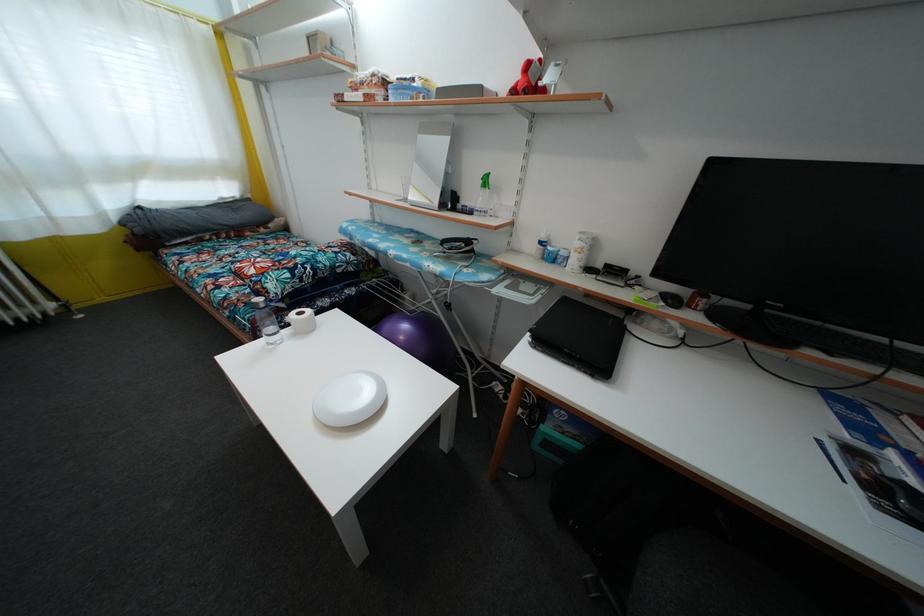
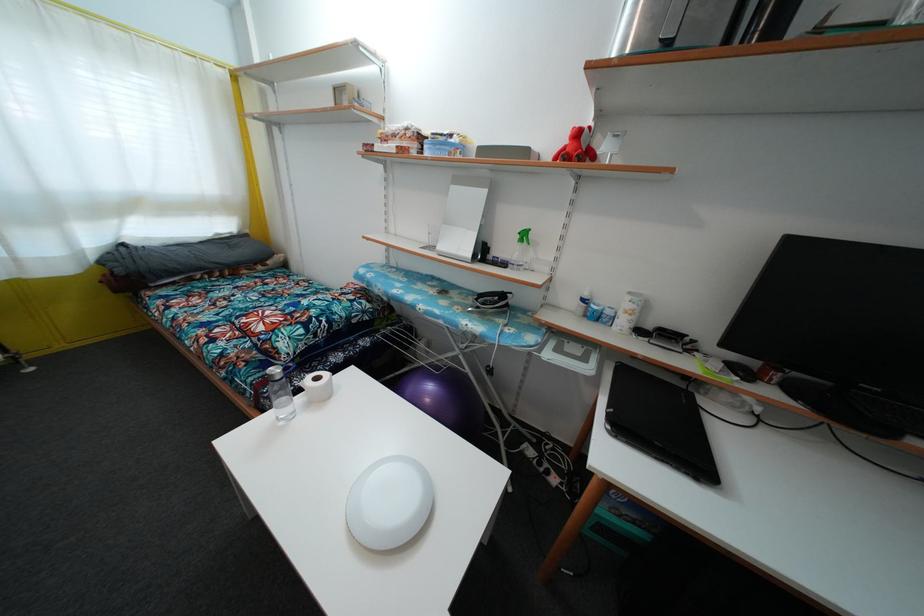
Find the pixel in the second image that matches point (603, 273) in the first image.

(652, 334)